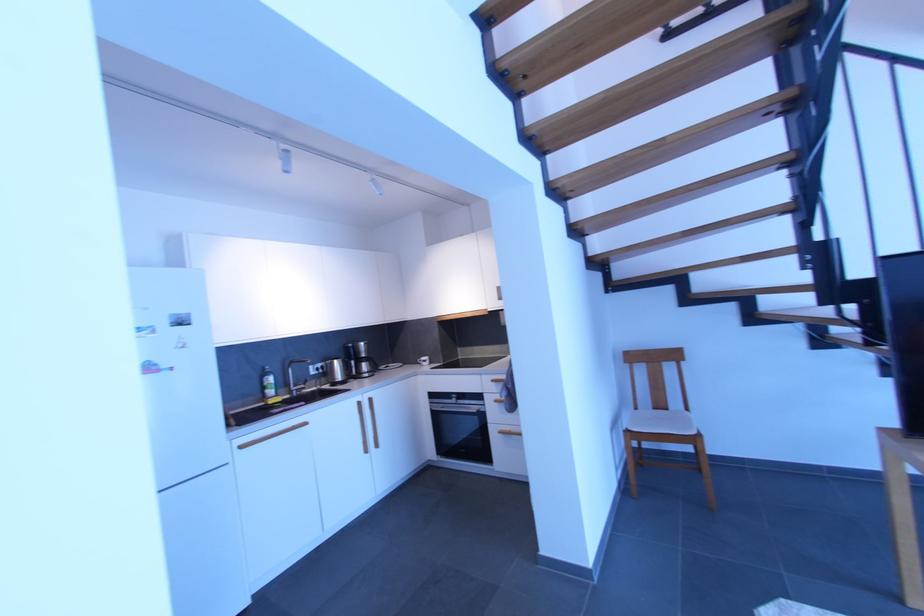
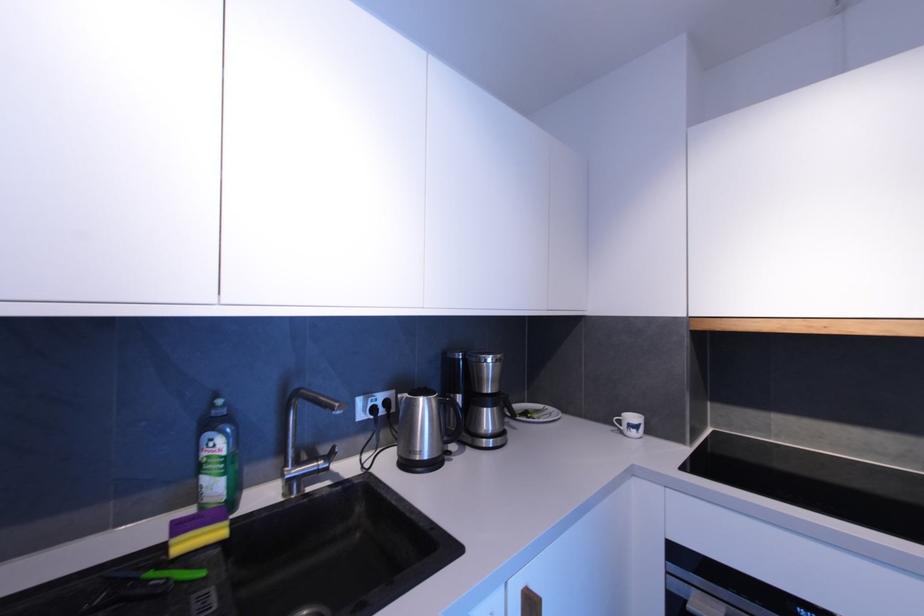
In the scene shown: Which direction would the cameraman need to move to produce the second image?

The cameraman moved toward left, forward.